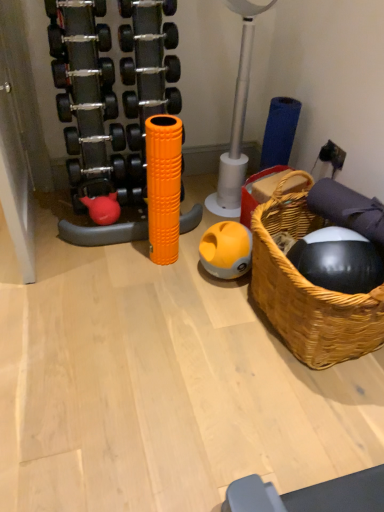
Locate an element on the screen. free spot to the left of woven wood basket at right is located at coordinates (190, 326).